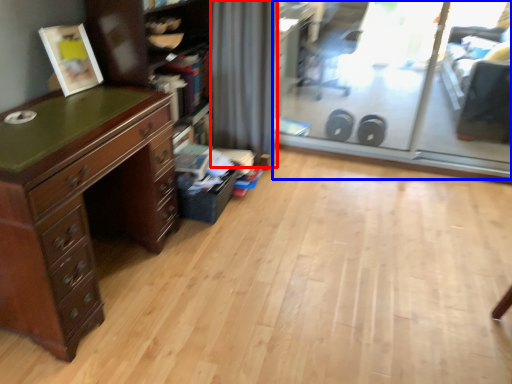
Question: Which object appears closest to the camera in this image, curtain (highlighted by a red box) or screen door (highlighted by a blue box)?

Choices:
 (A) curtain
 (B) screen door

Answer: (B)